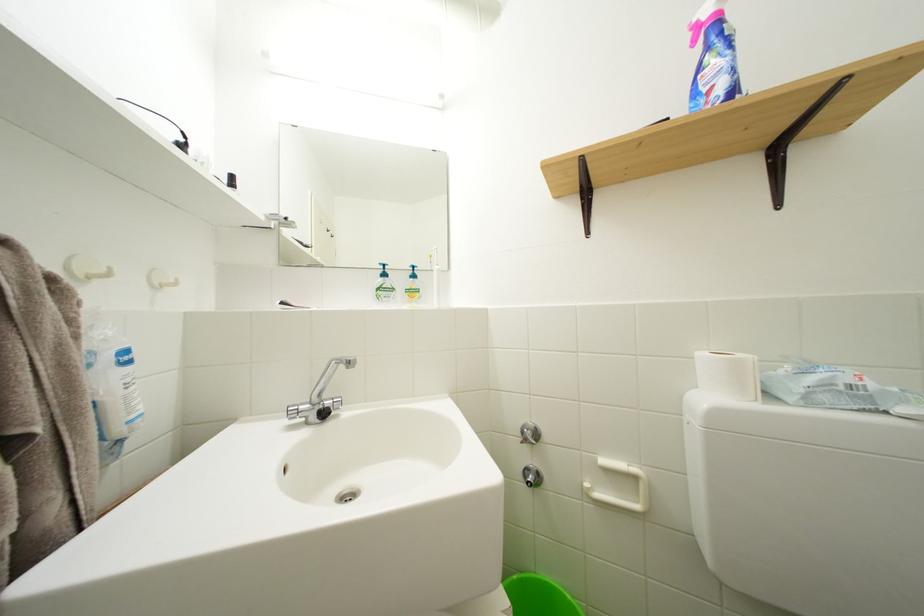
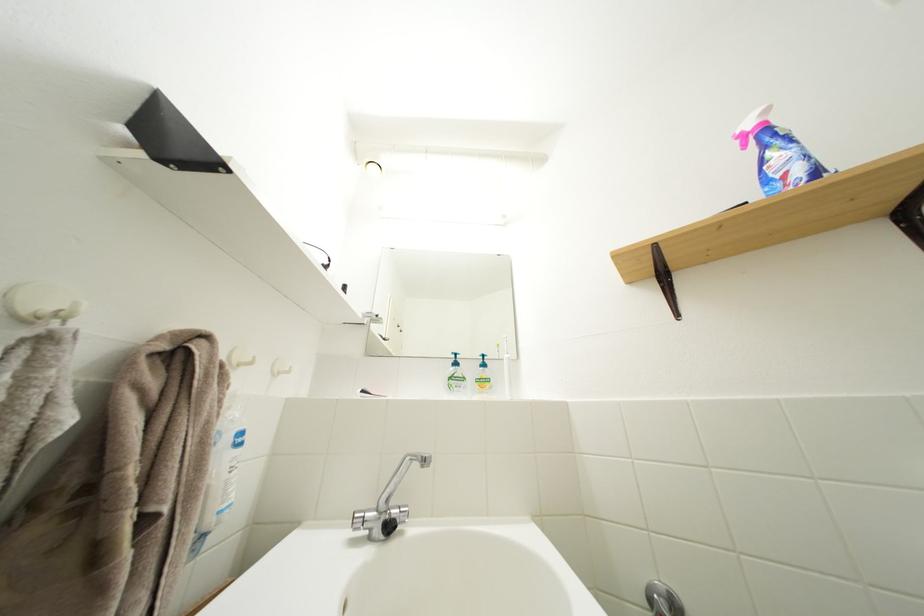
Locate, in the second image, the point that corresponds to point (330, 411) in the first image.

(396, 523)